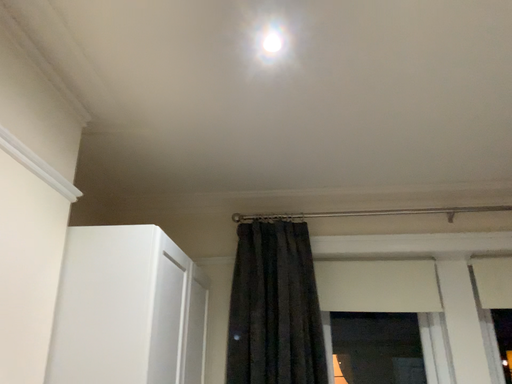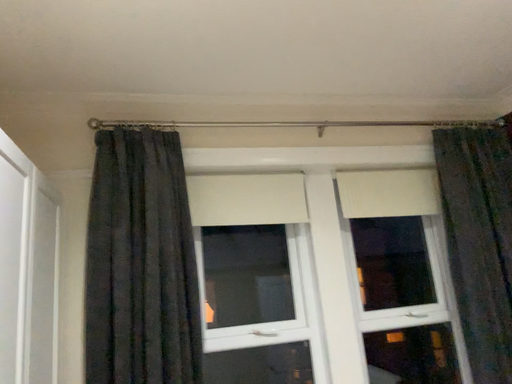
Question: Which way did the camera rotate in the video?

Choices:
 (A) rotated left
 (B) rotated right

Answer: (B)